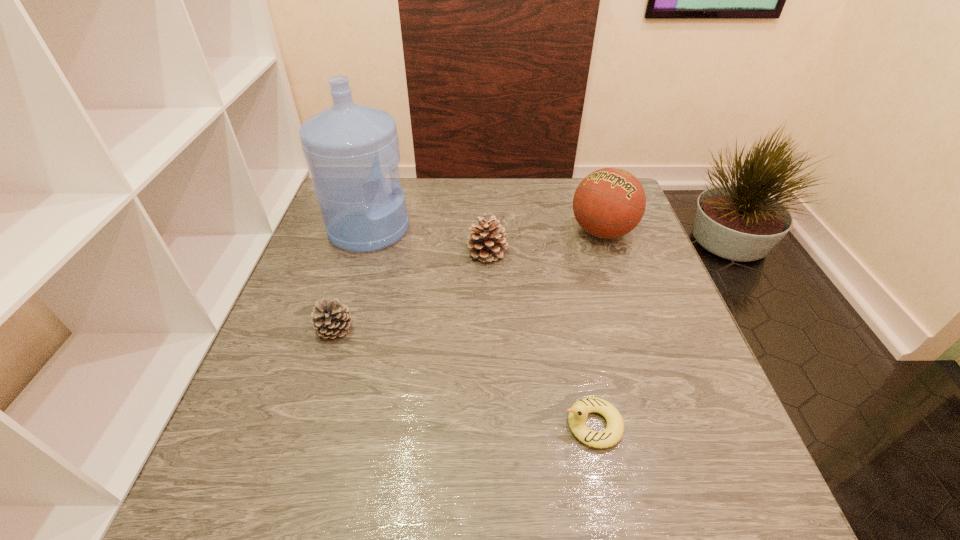
Locate an element on the screen. water jug is located at coordinates (349, 148).

Locate an element on the screen. Image resolution: width=960 pixels, height=540 pixels. the second tallest object is located at coordinates (610, 202).

Where is `the third tallest object`? This screenshot has width=960, height=540. the third tallest object is located at coordinates (486, 243).

Where is `the right pinecone`? The height and width of the screenshot is (540, 960). the right pinecone is located at coordinates (486, 243).

This screenshot has width=960, height=540. What are the coordinates of `the second shortest object` in the screenshot? It's located at (331, 319).

This screenshot has width=960, height=540. Find the location of `the left pinecone`. the left pinecone is located at coordinates (331, 319).

Identify the location of the nearest object. This screenshot has width=960, height=540. (578, 413).

Where is `duckling`? This screenshot has height=540, width=960. duckling is located at coordinates (578, 413).

The width and height of the screenshot is (960, 540). I want to click on free space located on the side of the tallest object with the handle, so click(524, 229).

Identify the location of vacant space located 0.130m on the back of the second tallest object. The image size is (960, 540). (588, 189).